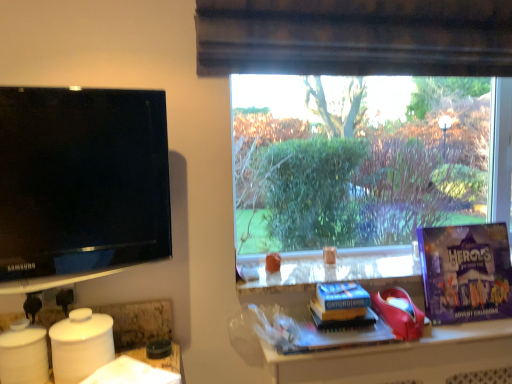
The height and width of the screenshot is (384, 512). Identify the location of blank space above hardcover book at center, acting as the second book starting from the top (from a real-world perspective). (336, 322).